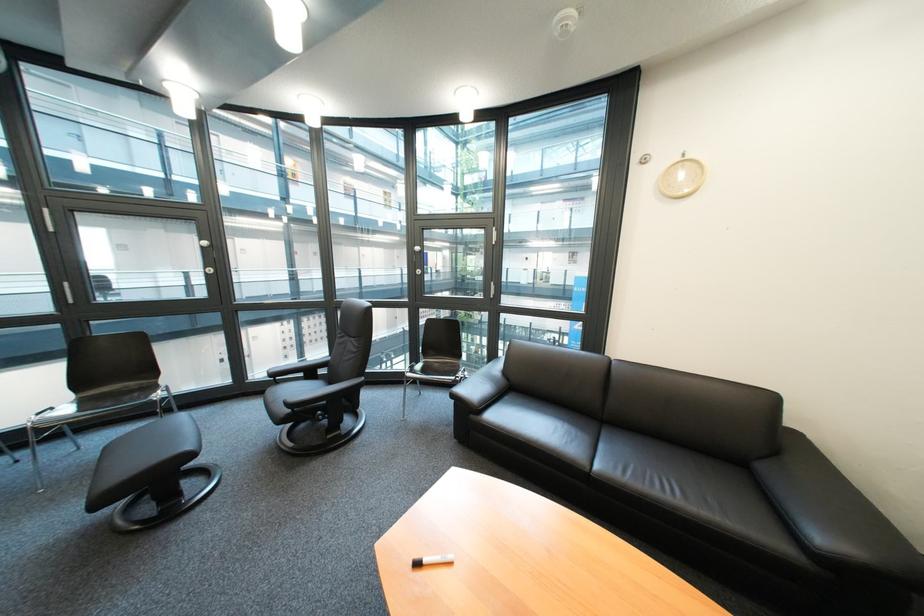
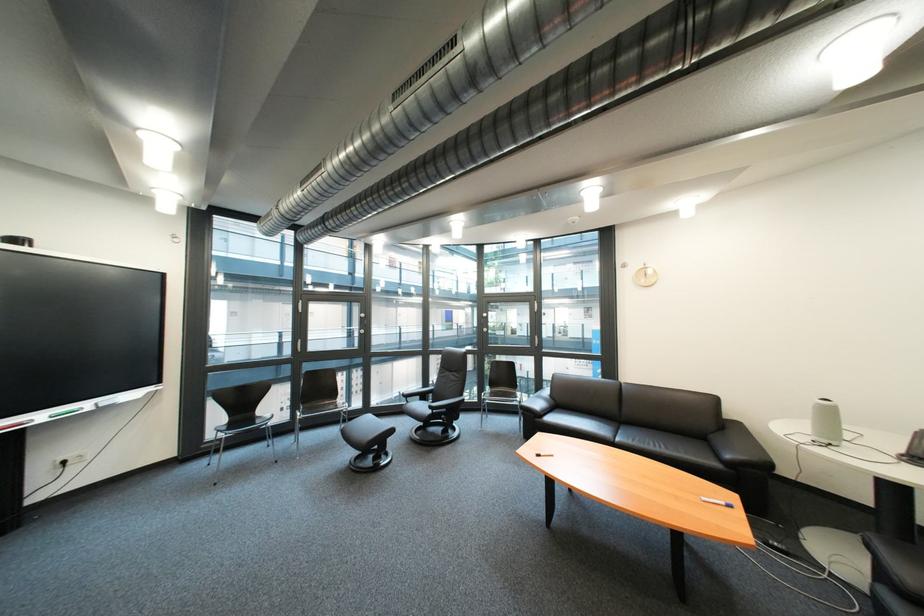
Where in the second image is the point corresponding to (614,447) from the first image?

(634, 434)